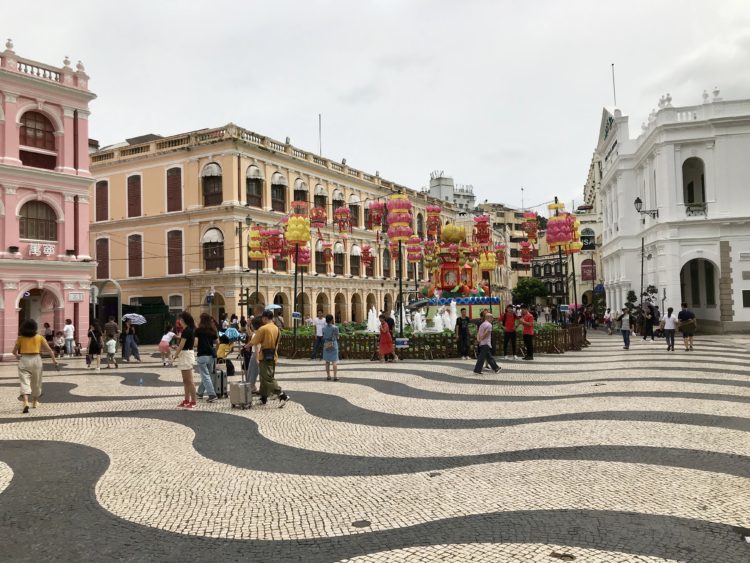
Locate an element on the screen. archway is located at coordinates (686, 288).